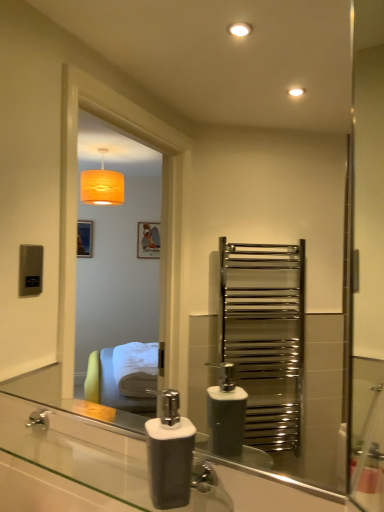
Describe the element at coordinates (169, 453) in the screenshot. This screenshot has height=512, width=384. I see `white matte soap dispenser at lower center` at that location.

This screenshot has width=384, height=512. What are the coordinates of `white matte soap dispenser at lower center` in the screenshot? It's located at (169, 453).

Describe the element at coordinates (79, 462) in the screenshot. The height and width of the screenshot is (512, 384). I see `translucent glass soap dispenser at lower center` at that location.

Measure the distance between point [146,480] and camera.

30.43 inches.

The image size is (384, 512). I want to click on translucent glass soap dispenser at lower center, so click(79, 462).

Locate an element on the screen. The width and height of the screenshot is (384, 512). white matte soap dispenser at lower center is located at coordinates (169, 453).

Which is more to the right, translucent glass soap dispenser at lower center or white matte soap dispenser at lower center?

From the viewer's perspective, white matte soap dispenser at lower center appears more on the right side.

Between translucent glass soap dispenser at lower center and white matte soap dispenser at lower center, which one is positioned behind?

white matte soap dispenser at lower center is more distant.

Which is closer, (x=122, y=474) or (x=159, y=498)?

Point (x=122, y=474).

From the image's perspective, is translucent glass soap dispenser at lower center above white matte soap dispenser at lower center?

No.

From a real-world perspective, is translucent glass soap dispenser at lower center positioned under white matte soap dispenser at lower center based on gravity?

Yes, from a real-world perspective, translucent glass soap dispenser at lower center is below white matte soap dispenser at lower center.

Considering the relative sizes of translucent glass soap dispenser at lower center and white matte soap dispenser at lower center in the image provided, is translucent glass soap dispenser at lower center thinner than white matte soap dispenser at lower center?

No, translucent glass soap dispenser at lower center is not thinner than white matte soap dispenser at lower center.

Can you confirm if translucent glass soap dispenser at lower center is taller than white matte soap dispenser at lower center?

No.

Can you confirm if translucent glass soap dispenser at lower center is smaller than white matte soap dispenser at lower center?

No, translucent glass soap dispenser at lower center is not smaller than white matte soap dispenser at lower center.

Based on the photo, is translucent glass soap dispenser at lower center surrounding white matte soap dispenser at lower center?

That's incorrect, white matte soap dispenser at lower center is not inside translucent glass soap dispenser at lower center.

Does translucent glass soap dispenser at lower center touch white matte soap dispenser at lower center?

No, translucent glass soap dispenser at lower center is not beside white matte soap dispenser at lower center.

Could you tell me if translucent glass soap dispenser at lower center is turned towards white matte soap dispenser at lower center?

No, translucent glass soap dispenser at lower center does not turn towards white matte soap dispenser at lower center.

Can you tell me how much translucent glass soap dispenser at lower center and white matte soap dispenser at lower center differ in facing direction?

The facing directions of translucent glass soap dispenser at lower center and white matte soap dispenser at lower center are 2.55 degrees apart.

How much distance is there between translucent glass soap dispenser at lower center and white matte soap dispenser at lower center?

translucent glass soap dispenser at lower center and white matte soap dispenser at lower center are 19.22 centimeters apart.

This screenshot has height=512, width=384. I want to click on soap dispenser lying behind the translucent glass soap dispenser at lower center, so click(x=169, y=453).

Between white matte soap dispenser at lower center and translucent glass soap dispenser at lower center, which one appears on the left side from the viewer's perspective?

translucent glass soap dispenser at lower center.

Which is in front, white matte soap dispenser at lower center or translucent glass soap dispenser at lower center?

translucent glass soap dispenser at lower center.

Does point (187, 468) come farther from viewer compared to point (57, 431)?

No, (187, 468) is in front of (57, 431).

From the image's perspective, is white matte soap dispenser at lower center located beneath translucent glass soap dispenser at lower center?

Actually, white matte soap dispenser at lower center appears above translucent glass soap dispenser at lower center in the image.

From a real-world perspective, relative to translucent glass soap dispenser at lower center, is white matte soap dispenser at lower center vertically above or below?

From a real-world perspective, white matte soap dispenser at lower center is physically above translucent glass soap dispenser at lower center.

Is white matte soap dispenser at lower center thinner than translucent glass soap dispenser at lower center?

Yes, white matte soap dispenser at lower center is thinner than translucent glass soap dispenser at lower center.

Is white matte soap dispenser at lower center shorter than translucent glass soap dispenser at lower center?

In fact, white matte soap dispenser at lower center may be taller than translucent glass soap dispenser at lower center.

Considering the sizes of objects white matte soap dispenser at lower center and translucent glass soap dispenser at lower center in the image provided, who is smaller, white matte soap dispenser at lower center or translucent glass soap dispenser at lower center?

white matte soap dispenser at lower center.

Is white matte soap dispenser at lower center spatially inside translucent glass soap dispenser at lower center, or outside of it?

white matte soap dispenser at lower center is located beyond the bounds of translucent glass soap dispenser at lower center.

Are white matte soap dispenser at lower center and translucent glass soap dispenser at lower center far apart?

They are positioned close to each other.

Is translucent glass soap dispenser at lower center at the back of white matte soap dispenser at lower center?

No, white matte soap dispenser at lower center is not facing the opposite direction of translucent glass soap dispenser at lower center.

What are the coordinates of `counter top below the white matte soap dispenser at lower center (from a real-world perspective)` in the screenshot? It's located at (79, 462).

In the image, there is a translucent glass soap dispenser at lower center. Where is `soap dispenser above it (from the image's perspective)`? soap dispenser above it (from the image's perspective) is located at coordinates (169, 453).

In order to click on counter top below the white matte soap dispenser at lower center (from the image's perspective) in this screenshot , I will do `click(79, 462)`.